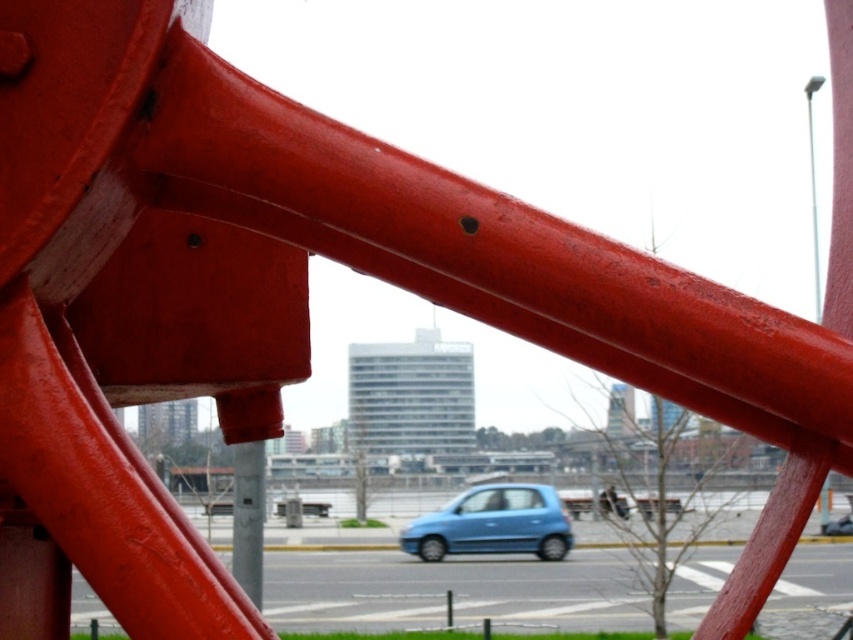
Between point (480, 502) and point (248, 557), which one is positioned in front?

Point (248, 557)

This screenshot has height=640, width=853. Describe the element at coordinates (492, 524) in the screenshot. I see `matte blue car at center` at that location.

The height and width of the screenshot is (640, 853). What do you see at coordinates (492, 524) in the screenshot?
I see `matte blue car at center` at bounding box center [492, 524].

Where is `matte blue car at center`? matte blue car at center is located at coordinates (492, 524).